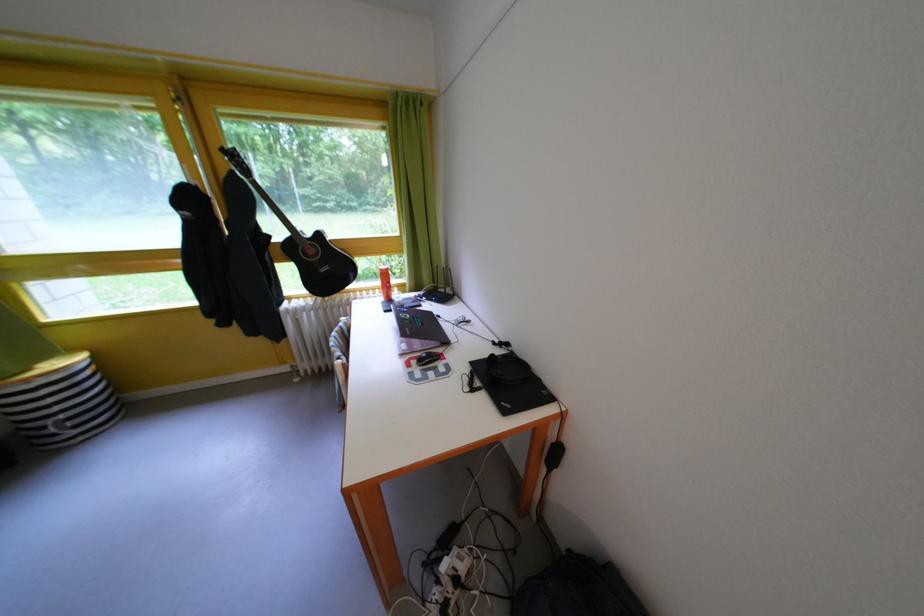
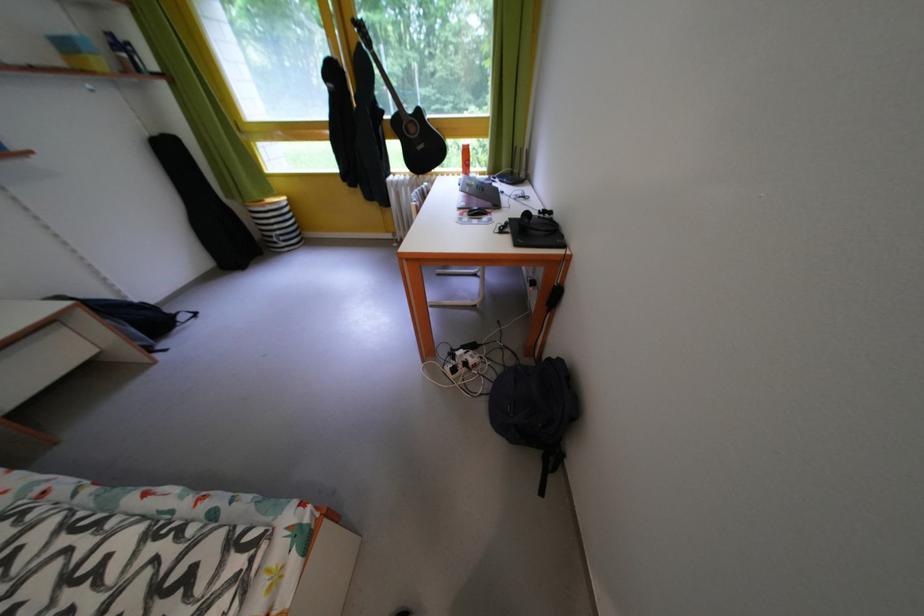
Locate, in the second image, the point that corresponds to the point at 466,586 in the first image.

(476, 370)